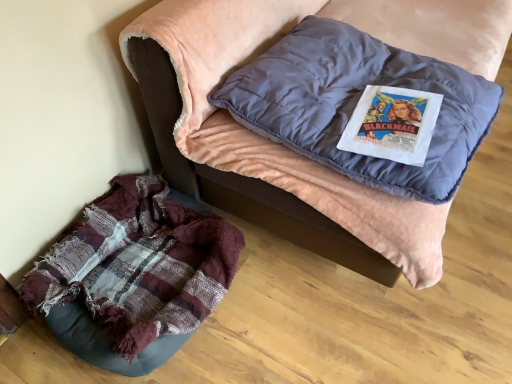
Find the location of a particular element. vacant space to the right of worn fabric bean bag at lower left is located at coordinates (280, 309).